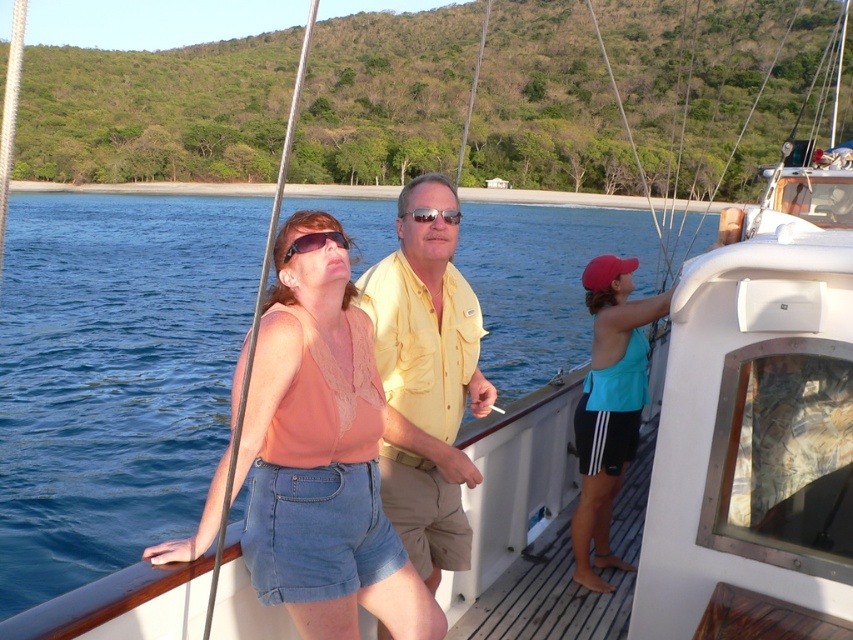
Question: Which point is closer to the camera?

Choices:
 (A) shiny gold sunglasses at center
 (B) matte peach tank top at center
 (C) yellow cotton shirt at center

Answer: (B)

Question: Can you confirm if matte peach tank top at center is positioned below teal fabric tank top at right?

Choices:
 (A) no
 (B) yes

Answer: (A)

Question: Is yellow cotton shirt at center wider than shiny gold sunglasses at center?

Choices:
 (A) yes
 (B) no

Answer: (A)

Question: Which point is closer to the camera taking this photo?

Choices:
 (A) (592, 381)
 (B) (343, 244)
 (C) (471, 346)
 (D) (283, 572)

Answer: (D)

Question: Is matte black sunglasses at center positioned behind shiny gold sunglasses at center?

Choices:
 (A) yes
 (B) no

Answer: (B)

Question: Which point is closer to the camera taking this photo?

Choices:
 (A) (451, 212)
 (B) (412, 408)
 (C) (654, 300)

Answer: (B)